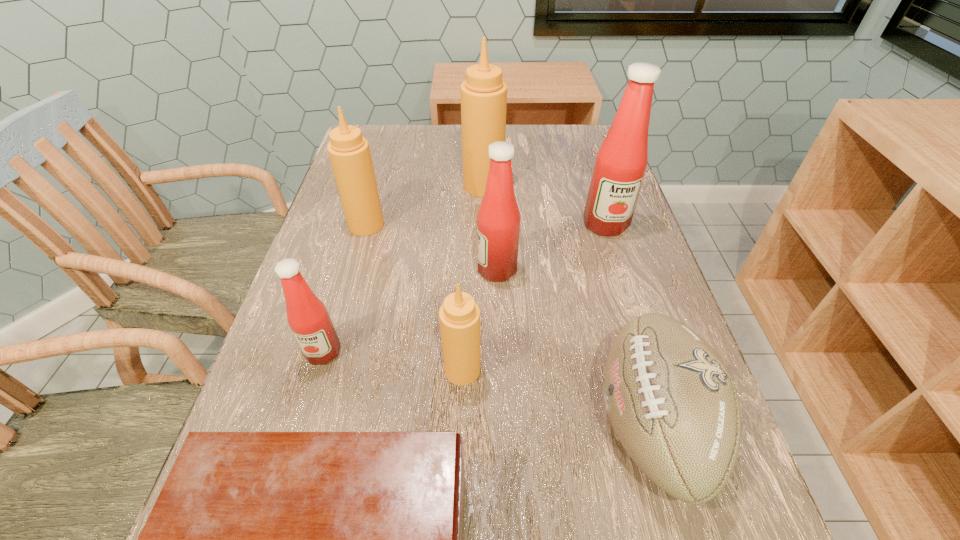
Find the location of a particular element. the farthest condiment is located at coordinates (483, 94).

Find the location of a particular element. the farthest object is located at coordinates (483, 94).

Identify the location of the farthest red condiment. (621, 161).

The width and height of the screenshot is (960, 540). I want to click on the rightmost red condiment, so click(621, 161).

Where is `the second nearest tan condiment`? The height and width of the screenshot is (540, 960). the second nearest tan condiment is located at coordinates [x=349, y=152].

This screenshot has height=540, width=960. I want to click on the leftmost tan condiment, so coord(349,152).

You are a GUI agent. You are given a task and a screenshot of the screen. Output one action in this format:
    pyautogui.click(x=<x>, y=<y>)
    Task: Click on the third nearest condiment
    This screenshot has height=540, width=960.
    Given the screenshot: What is the action you would take?
    pos(498,220)

Where is `the second red condiment from right to left`? the second red condiment from right to left is located at coordinates (498, 220).

I want to click on the nearest tan condiment, so click(459, 316).

Identify the location of the nearest red condiment. (308, 318).